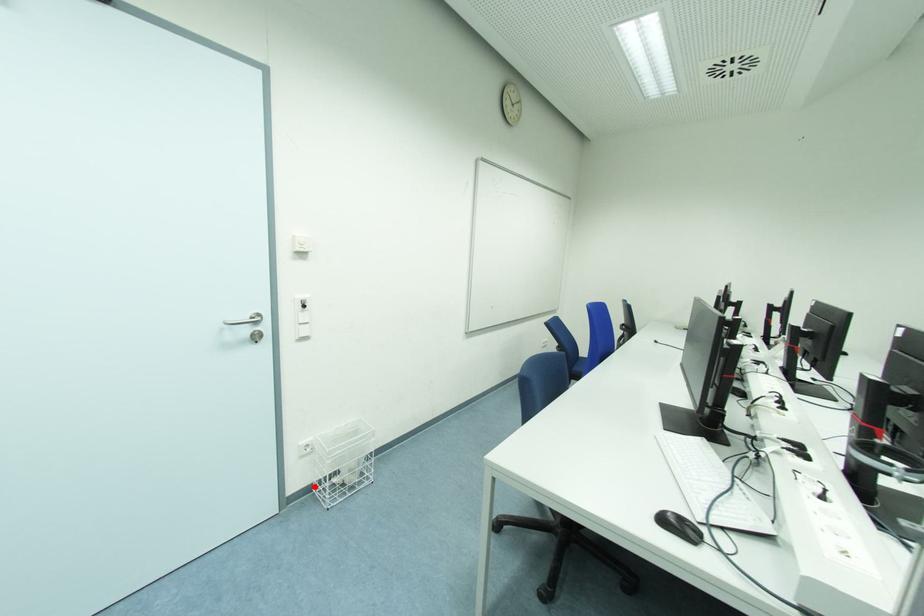
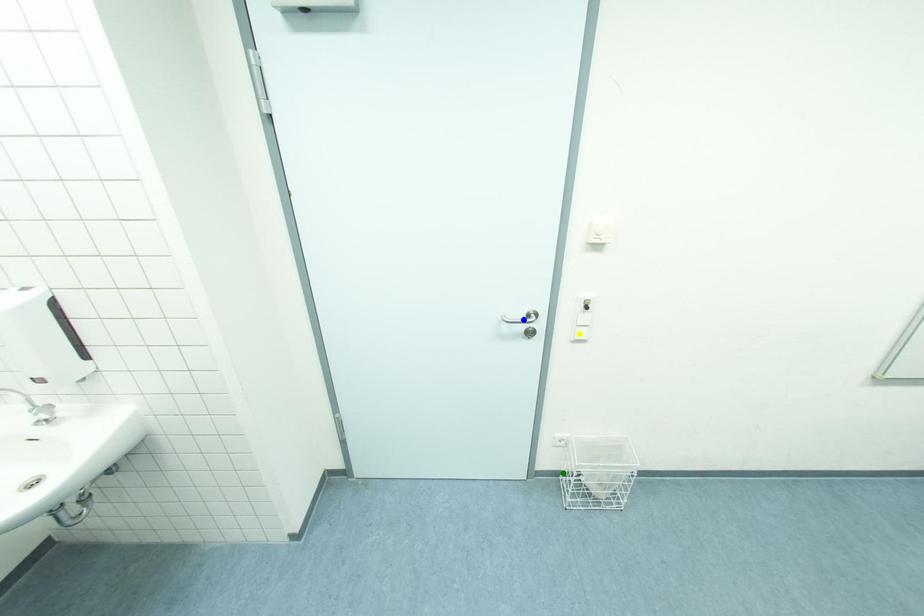
Question: I am providing you with two images of the same scene from different viewpoints. A red point is marked on the first image. You are given multiple points on the second image. Can you choose the point in image 2 that corresponds to the point in image 1?

Choices:
 (A) blue point
 (B) yellow point
 (C) green point

Answer: (C)